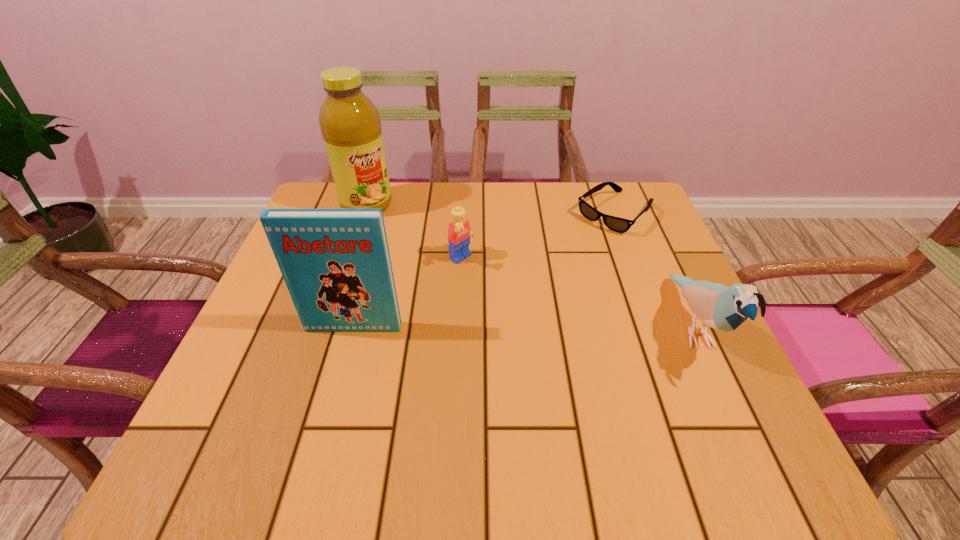
Locate an element on the screen. The height and width of the screenshot is (540, 960). free spot on the desktop that is between the book and the bird and is positioned on the front label of the fruit juice is located at coordinates (478, 327).

You are a GUI agent. You are given a task and a screenshot of the screen. Output one action in this format:
    pyautogui.click(x=<x>, y=<y>)
    Task: Click on the free spot on the desktop that is between the second tallest object and the third tallest object and is positioned on the front-facing side of the sunglasses
    The width and height of the screenshot is (960, 540).
    Given the screenshot: What is the action you would take?
    pyautogui.click(x=479, y=327)

This screenshot has height=540, width=960. Find the location of `free space on the desktop that is between the book and the third shortest object and is positioned on the face of the Lego`. free space on the desktop that is between the book and the third shortest object and is positioned on the face of the Lego is located at coordinates (561, 327).